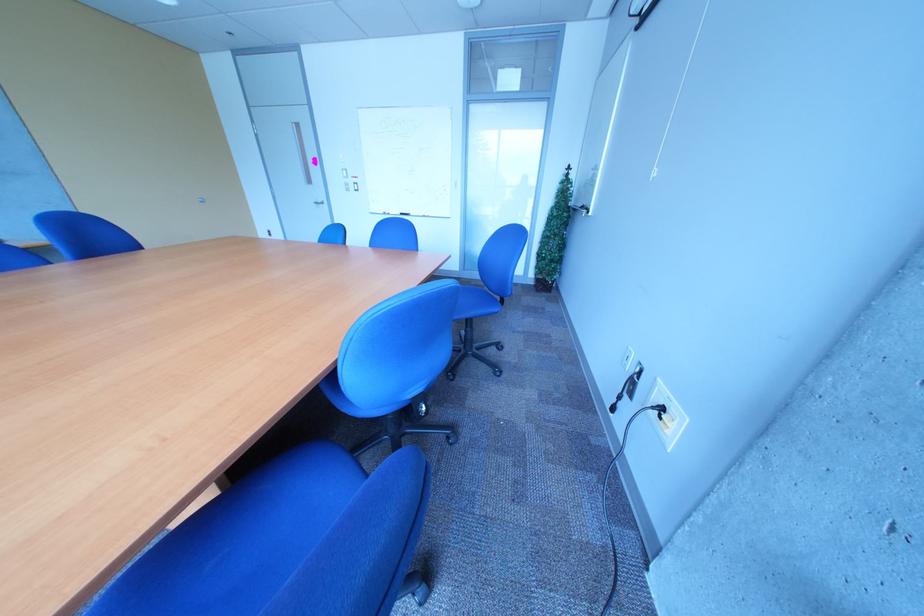
Identify the location of silver door handle. Image resolution: width=924 pixels, height=616 pixels. (320, 201).